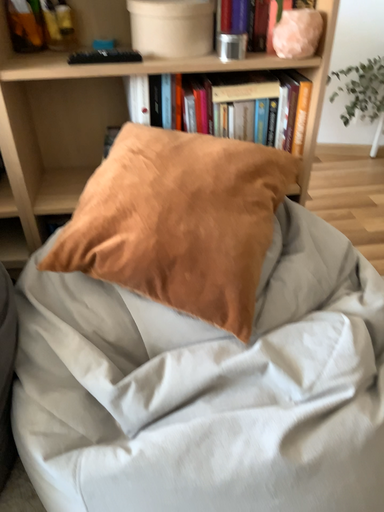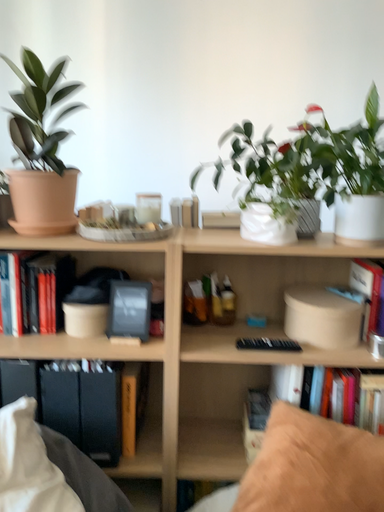
Question: How did the camera likely rotate when shooting the video?

Choices:
 (A) rotated left
 (B) rotated right

Answer: (A)